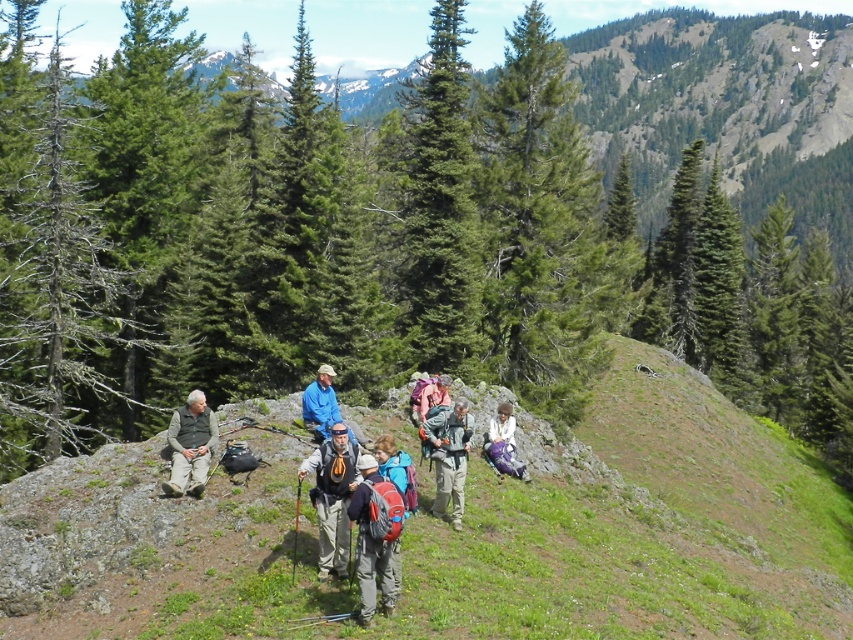
Is green matte evergreen tree at center closer to camera compared to matte green backpack at center?

No, it is behind matte green backpack at center.

Between green matte evergreen tree at center and matte green backpack at center, which one appears on the right side from the viewer's perspective?

Positioned to the right is matte green backpack at center.

The image size is (853, 640). What do you see at coordinates (440, 205) in the screenshot?
I see `green matte evergreen tree at center` at bounding box center [440, 205].

The height and width of the screenshot is (640, 853). I want to click on green matte evergreen tree at center, so point(440,205).

Is matte gray backpack at center positioned in front of matte green backpack at center?

Yes.

Is point (335, 420) farther from viewer compared to point (436, 449)?

Yes, it is.

The width and height of the screenshot is (853, 640). Find the location of `matte gray backpack at center`. matte gray backpack at center is located at coordinates (332, 497).

Who is higher up, matte green backpack at center or purple fabric bag at center?

matte green backpack at center

Is point (444, 458) closer to viewer compared to point (498, 451)?

Yes, it is.

In order to click on matte green backpack at center in this screenshot , I will do `click(450, 456)`.